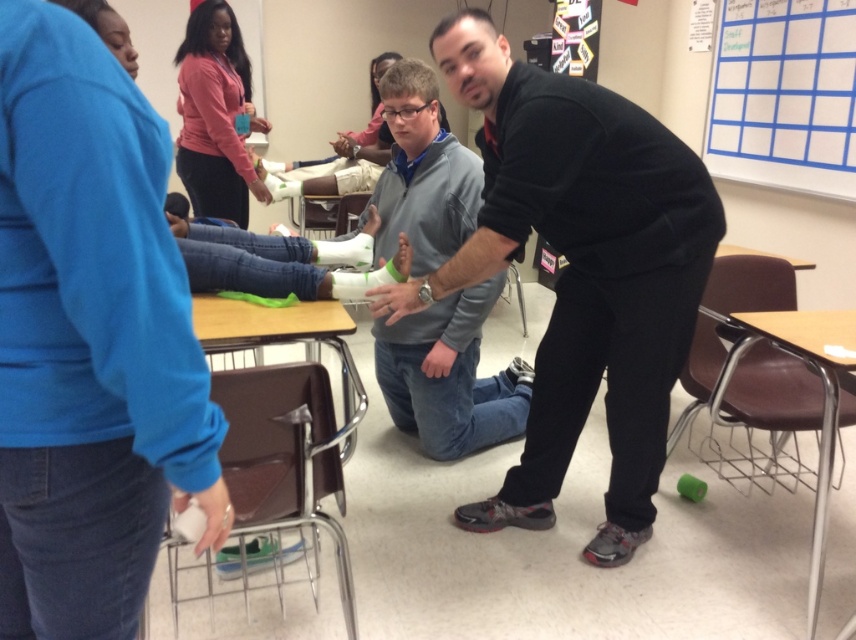
Does black matte jacket at upper left come in front of black matte shirt at center?

Yes, it is.

Can you confirm if black matte jacket at upper left is bigger than black matte shirt at center?

No.

Is point (33, 28) in front of point (663, 125)?

Yes, it is in front of point (663, 125).

I want to click on black matte jacket at upper left, so click(88, 339).

Does pink fabric shirt at upper left lie in front of brown leather table at lower right?

No.

Between pink fabric shirt at upper left and brown leather table at lower right, which one has less height?

brown leather table at lower right is shorter.

Does point (223, 168) lie in front of point (834, 339)?

No, (223, 168) is further to viewer.

Image resolution: width=856 pixels, height=640 pixels. Find the location of `pink fabric shirt at upper left`. pink fabric shirt at upper left is located at coordinates (214, 115).

Can you confirm if gray fleece jacket at center is positioned to the left of pink fabric shirt at upper left?

In fact, gray fleece jacket at center is to the right of pink fabric shirt at upper left.

Who is more distant from viewer, (414, 102) or (187, 40)?

The point (187, 40) is more distant.

Is point (524, 384) farther from camera compared to point (212, 180)?

No.

Locate an element on the screen. This screenshot has width=856, height=640. gray fleece jacket at center is located at coordinates [449, 376].